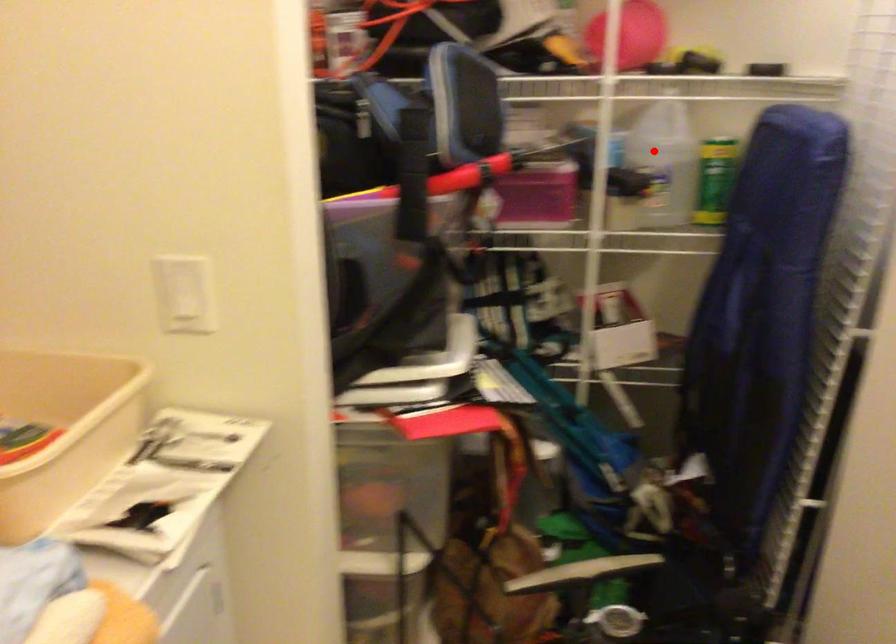
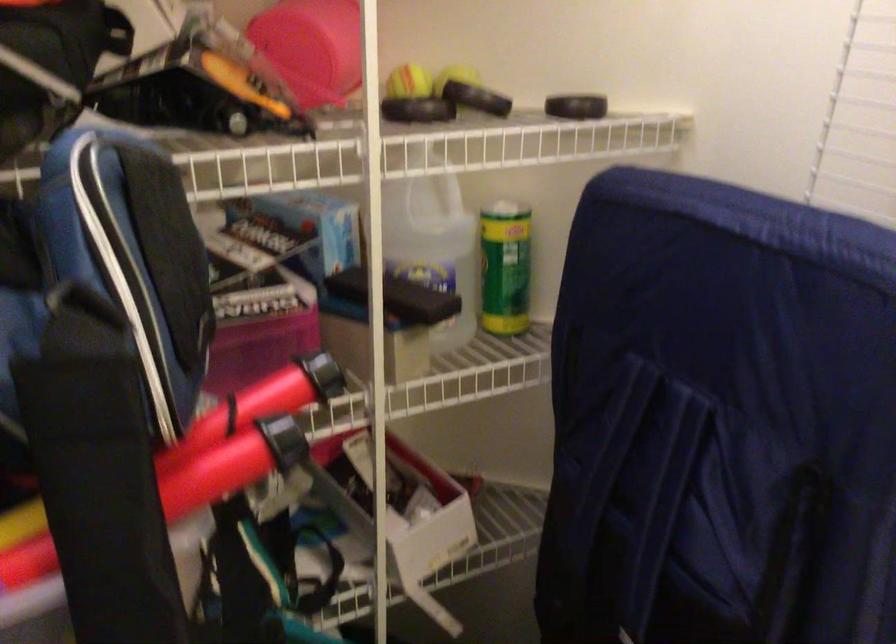
Question: I am providing you with two images of the same scene from different viewpoints. Given a red point in image1, look at the same physical point in image2. Is it:

Choices:
 (A) Closer to the viewpoint
 (B) Farther from the viewpoint

Answer: (A)